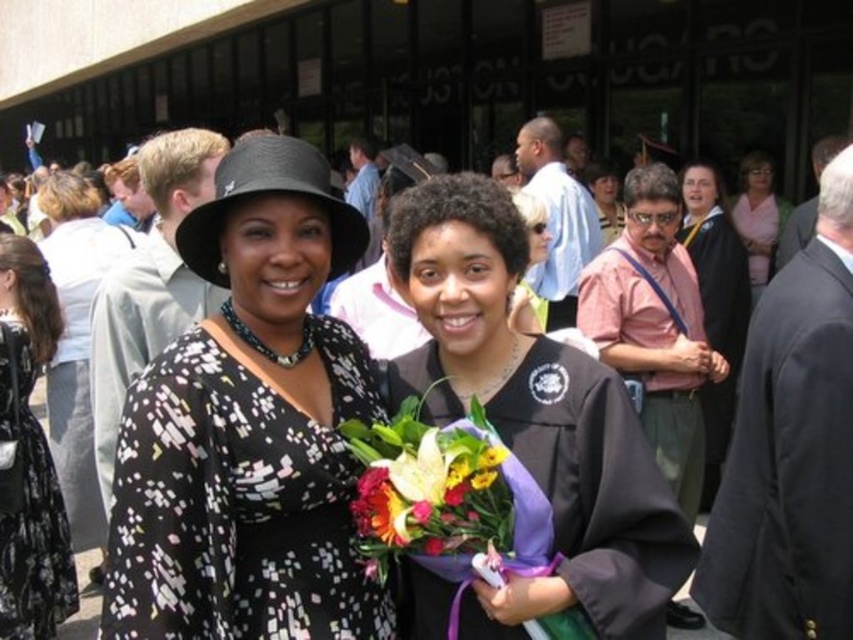
Is point (386, 500) positioned before point (755, 168)?

That is True.

I want to click on vibrant floral bouquet at center, so click(428, 490).

Who is taller, black matte dress at center or vibrant floral bouquet at center?

Standing taller between the two is black matte dress at center.

Does point (358, 625) come closer to viewer compared to point (450, 500)?

No, it is not.

What are the coordinates of `black matte dress at center` in the screenshot? It's located at (248, 428).

Is black matte dress at center taller than pink fabric at upper right?

Incorrect, black matte dress at center's height is not larger of pink fabric at upper right's.

Is point (339, 461) closer to camera compared to point (757, 216)?

Yes, it is in front of point (757, 216).

Is point (332, 570) behind point (755, 282)?

No, it is in front of (755, 282).

Find the location of a particular element. black matte dress at center is located at coordinates (248, 428).